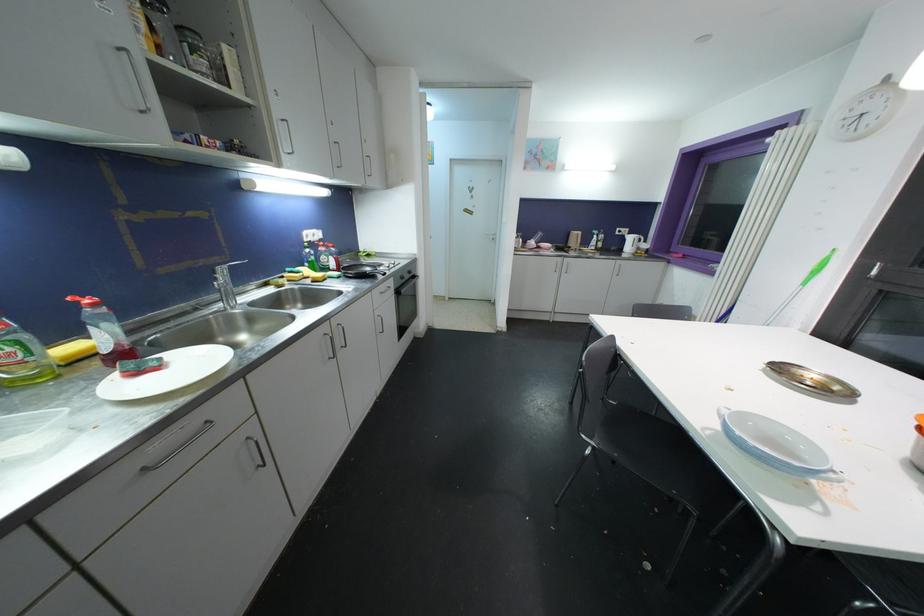
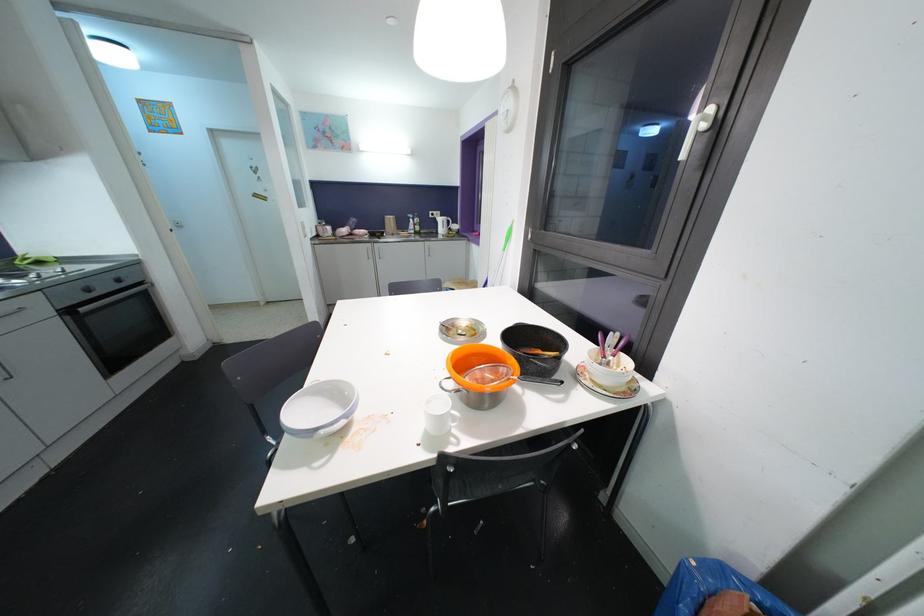
Find the pixel in the second image that matches [406,294] in the first image.

(84, 312)